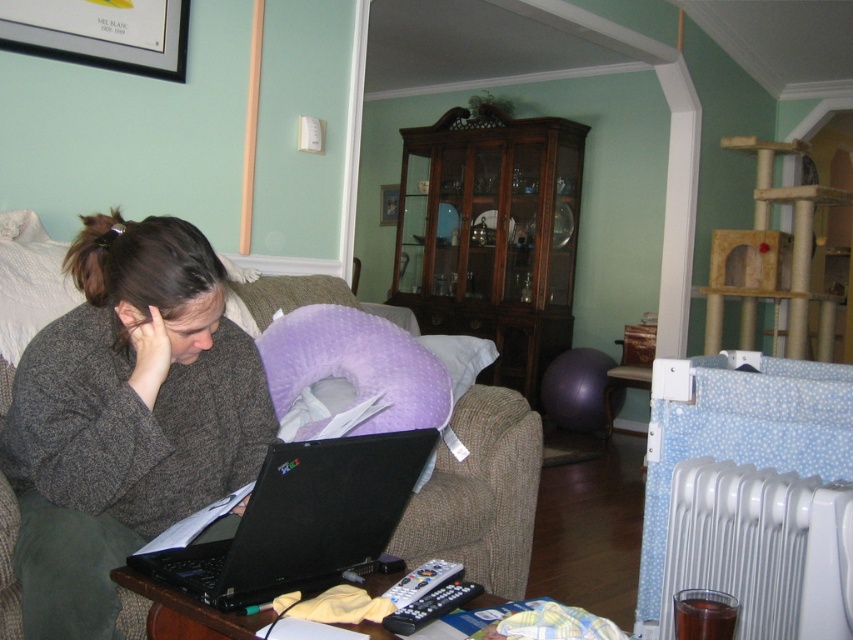
You are a delivery robot trying to place a package on the surface between the brown fabric couch at center and the black matte laptop at lower center. Can you place the package there?

The brown fabric couch at center is positioned under the black matte laptop at lower center, so there is no space between them for the delivery robot to place the package.

You are a delivery robot that needs to place a small package on the surface between the black matte laptop at lower center and the white plastic radiator at lower right. Can the package be placed there without being blocked by either object?

The black matte laptop at lower center is shorter than the white plastic radiator at lower right. Since the package is small, it can be placed between them as long as it doesn not exceed the height of the shorter object, which is the black matte laptop at lower center.